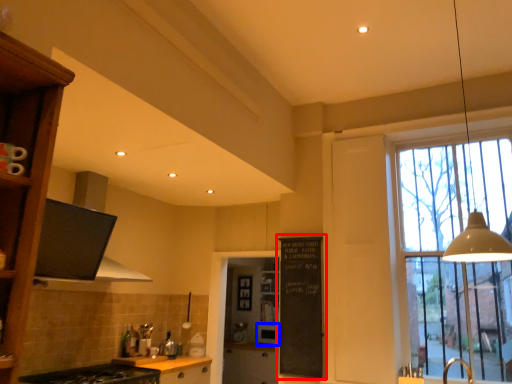
Question: Which object appears farthest to the camera in this image, bulletin board (highlighted by a red box) or appliance (highlighted by a blue box)?

Choices:
 (A) bulletin board
 (B) appliance

Answer: (B)